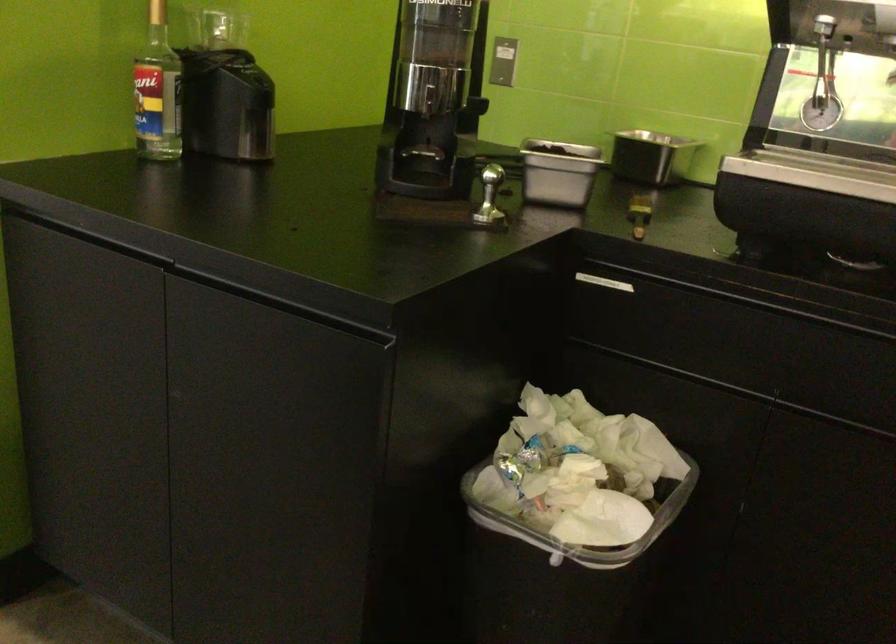
Find where to lift the silver coffee tamper. Please return your answer as a coordinate pair (x, y).

(433, 100)